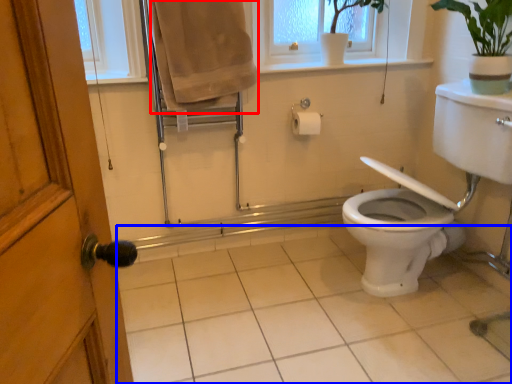
Question: Which of the following is the closest to the observer, bath towel (highlighted by a red box) or plain (highlighted by a blue box)?

Choices:
 (A) bath towel
 (B) plain

Answer: (B)